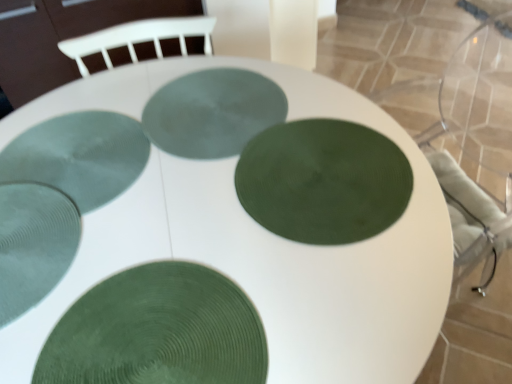
The height and width of the screenshot is (384, 512). In order to click on free space above green textured plate at center, which appears as the first glass plate when viewed from the front (from a real-world perspective) in this screenshot , I will do `click(162, 331)`.